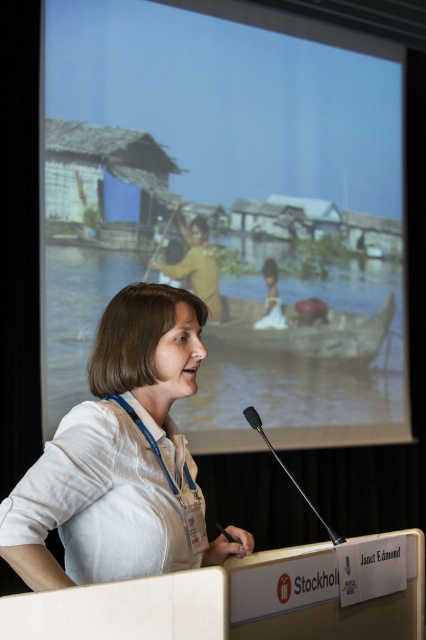
Does matte plastic screen at upper center lie in front of white linen shirt at center?

No.

Which is more to the right, matte plastic screen at upper center or white linen shirt at center?

From the viewer's perspective, matte plastic screen at upper center appears more on the right side.

Does point (276, 433) come farther from viewer compared to point (178, 332)?

Yes, it is.

At what (x,y) coordinates should I click in order to perform the action: click on matte plastic screen at upper center. Please return your answer as a coordinate pair (x, y). Image resolution: width=426 pixels, height=640 pixels. Looking at the image, I should click on (232, 205).

Who is positioned more to the right, matte plastic screen at upper center or black metallic microphone at center?

From the viewer's perspective, matte plastic screen at upper center appears more on the right side.

Is matte plastic screen at upper center taller than black metallic microphone at center?

Yes, matte plastic screen at upper center is taller than black metallic microphone at center.

The height and width of the screenshot is (640, 426). What do you see at coordinates (232, 205) in the screenshot? I see `matte plastic screen at upper center` at bounding box center [232, 205].

What are the coordinates of `matte plastic screen at upper center` in the screenshot? It's located at (232, 205).

Is matte plastic screen at upper center to the right of yellow matte shirt at center from the viewer's perspective?

Indeed, matte plastic screen at upper center is positioned on the right side of yellow matte shirt at center.

Describe the element at coordinates (232, 205) in the screenshot. The width and height of the screenshot is (426, 640). I see `matte plastic screen at upper center` at that location.

Identify the location of matte plastic screen at upper center. This screenshot has height=640, width=426. tap(232, 205).